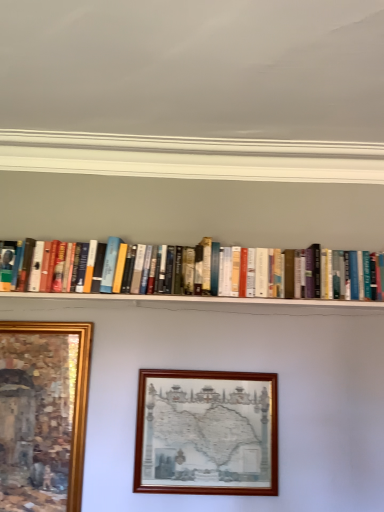
You are a GUI agent. You are given a task and a screenshot of the screen. Output one action in this format:
    pyautogui.click(x=<x>, y=<y>)
    Task: Click on the vacant area on top of wooden picture frame at center, which is the second picture frame in left-to-right order (from a real-world perspective)
    This screenshot has height=512, width=384.
    Given the screenshot: What is the action you would take?
    pyautogui.click(x=219, y=368)